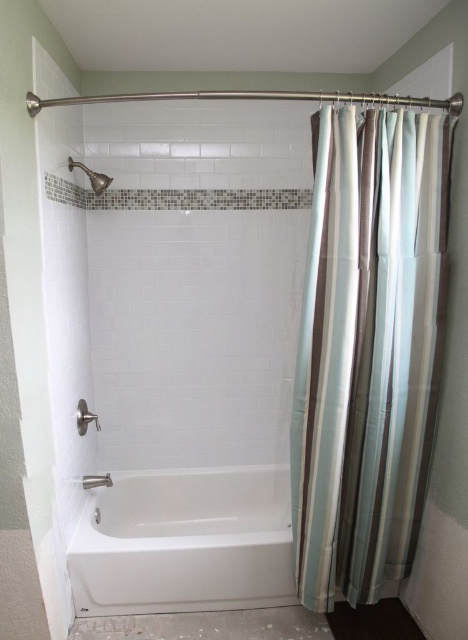
You are standing in the bathroom and want to take a shower. To do so, you need to move the striped fabric shower curtain at right out of the way. However, you notice the brushed metal showerhead at upper left is in a position that might interfere. Based on their positions, can you determine if the showerhead is to the left or right of the shower curtain?

The striped fabric shower curtain at right is positioned on the right side of the brushed metal showerhead at upper left, meaning the showerhead is to the left of the shower curtain.

You are standing in the bathroom and want to see the brushed metal showerhead at upper left. Is it currently visible behind the striped fabric shower curtain at right?

The striped fabric shower curtain at right is in front of the brushed metal showerhead at upper left, so the showerhead is not visible behind the curtain.